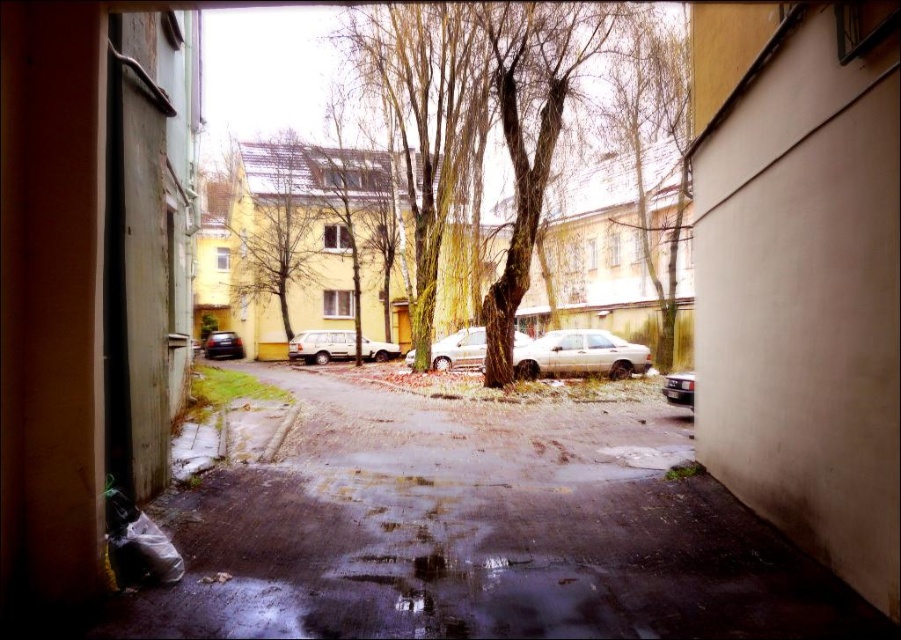
You are driving a car and want to exit the alleyway shown in the image. You see the white matte car at center and the shiny silver car at right. Which car is blocking your path to the alley exit?

The shiny silver car at right is behind the white matte car at center, so the white matte car at center is blocking the path to the alley exit.

You are standing at the entrance of the doorway on the left side of the alleyway. You want to walk to the point marked as point (x=349, y=339). Which direction should you go relative to point (x=690, y=385)?

Since point (x=349, y=339) is behind point (x=690, y=385), you should walk towards the direction behind point (x=690, y=385) to reach your destination.

You are a delivery driver who needs to park your vehicle in the alley. Your car is the same size as the shiny black car at center. There is a smooth asphalt road at center to your right. Can you safely move your car to the left to make space for another vehicle without going off the road?

The smooth asphalt road at center is to the right of the shiny black car at center, so you can safely move your car to the left as there is enough space on the right side of the road. However, ensure that moving left doesn